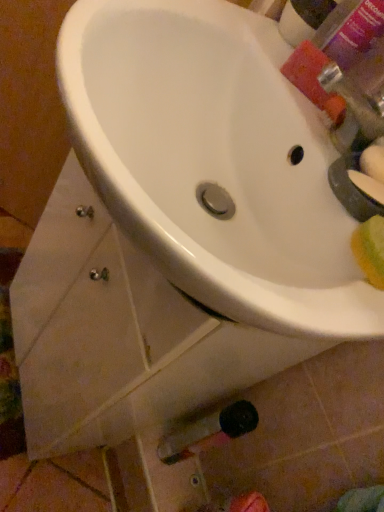
Identify the location of free space in front of pink matte bottle at upper right. (270, 46).